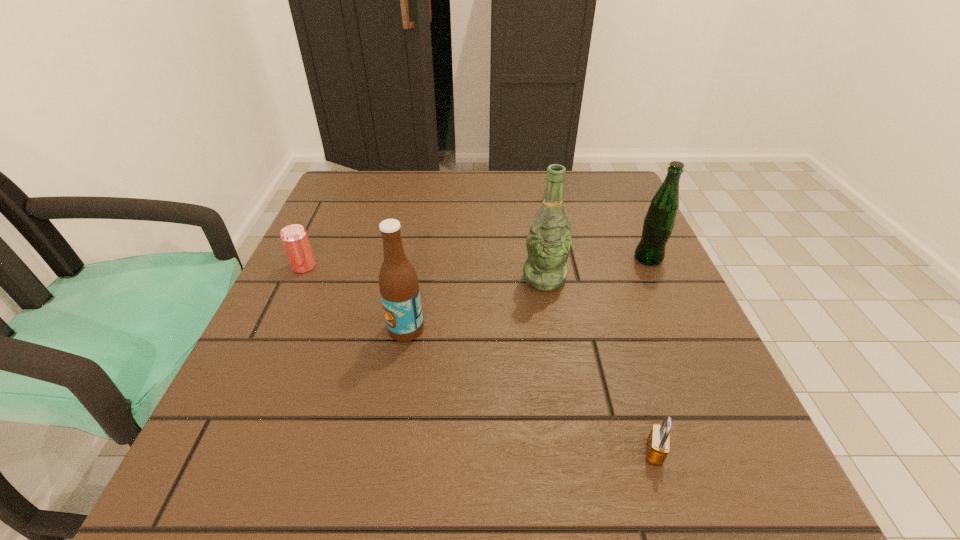
At what (x,y) coordinates should I click in order to perform the action: click on blank area in the image that satisfies the following two spatial constraints: 1. on the surface of the second object from right to left; 2. on the right side of the second beer bottle from left to right. Please return your answer as a coordinate pair (x, y). The image size is (960, 540). Looking at the image, I should click on (573, 452).

The height and width of the screenshot is (540, 960). What are the coordinates of `free space that satisfies the following two spatial constraints: 1. on the back side of the nearest beer bottle; 2. on the left side of the rightmost beer bottle` in the screenshot? It's located at (418, 258).